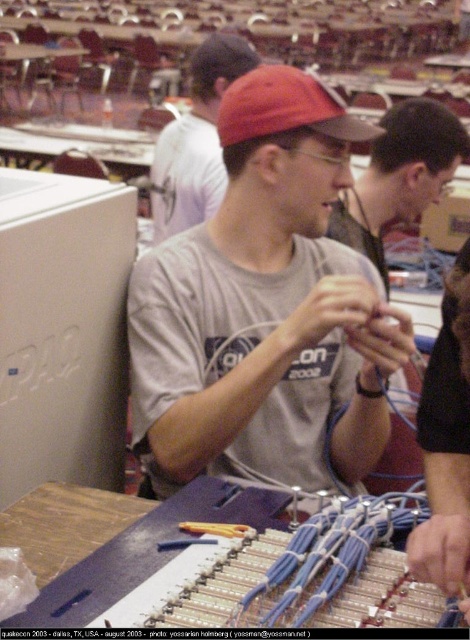
You are a technician who needs to reach both the white plastic computer at left and the red matte cap at center during your work. Given that your arms can comfortably reach 18 inches, can you comfortably reach both items without moving your position?

The white plastic computer at left and the red matte cap at center are 18.25 inches apart from each other. Since your arms can only reach 18 inches, you cannot comfortably reach both items without moving your position.